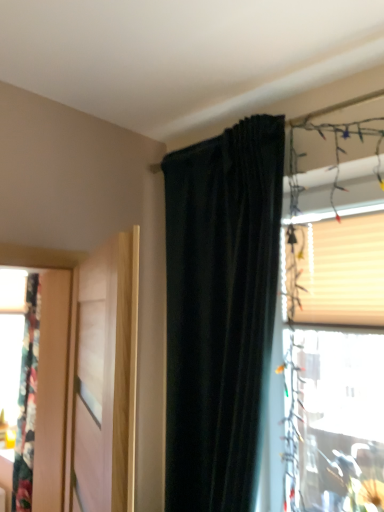
Question: Is beige textured blind at upper right completely or partially outside of dark velvet curtain at upper center?

Choices:
 (A) no
 (B) yes

Answer: (B)

Question: Is beige textured blind at upper right behind dark velvet curtain at upper center?

Choices:
 (A) no
 (B) yes

Answer: (B)

Question: Does beige textured blind at upper right have a smaller size compared to dark velvet curtain at upper center?

Choices:
 (A) yes
 (B) no

Answer: (A)

Question: From the image's perspective, is beige textured blind at upper right above dark velvet curtain at upper center?

Choices:
 (A) no
 (B) yes

Answer: (B)

Question: Could you tell me if beige textured blind at upper right is facing dark velvet curtain at upper center?

Choices:
 (A) yes
 (B) no

Answer: (A)

Question: Visually, is dark velvet curtain at upper center positioned to the left or to the right of translucent plastic window at upper right?

Choices:
 (A) left
 (B) right

Answer: (A)

Question: Is dark velvet curtain at upper center situated inside translucent plastic window at upper right or outside?

Choices:
 (A) outside
 (B) inside

Answer: (A)

Question: Is dark velvet curtain at upper center wider or thinner than translucent plastic window at upper right?

Choices:
 (A) thin
 (B) wide

Answer: (B)

Question: From the image's perspective, relative to translucent plastic window at upper right, is dark velvet curtain at upper center above or below?

Choices:
 (A) above
 (B) below

Answer: (B)

Question: From a real-world perspective, is translucent plastic window at upper right physically located above or below light wood door at left?

Choices:
 (A) below
 (B) above

Answer: (B)

Question: From the image's perspective, is translucent plastic window at upper right located above or below light wood door at left?

Choices:
 (A) above
 (B) below

Answer: (A)

Question: Relative to light wood door at left, is translucent plastic window at upper right in front or behind?

Choices:
 (A) front
 (B) behind

Answer: (B)

Question: Is translucent plastic window at upper right wider or thinner than light wood door at left?

Choices:
 (A) wide
 (B) thin

Answer: (B)

Question: From the image's perspective, is translucent plastic window at upper right positioned above or below beige textured blind at upper right?

Choices:
 (A) below
 (B) above

Answer: (A)

Question: Relative to beige textured blind at upper right, is translucent plastic window at upper right in front or behind?

Choices:
 (A) behind
 (B) front

Answer: (B)